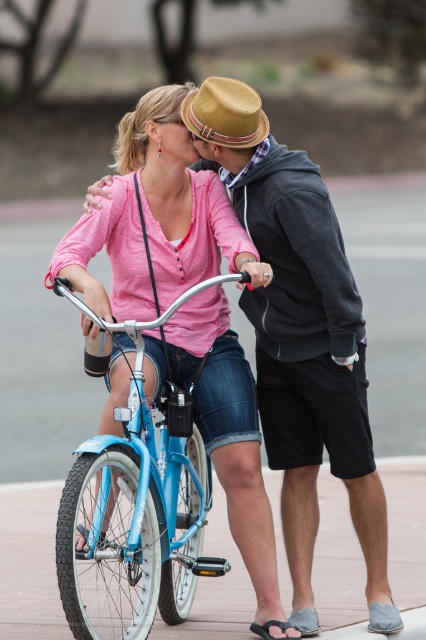
Question: Is matte pink shirt at center further to the viewer compared to blue metallic bicycle at center?

Choices:
 (A) no
 (B) yes

Answer: (B)

Question: Is matte pink shirt at center below blue metallic bicycle at center?

Choices:
 (A) yes
 (B) no

Answer: (B)

Question: Which object appears closest to the camera in this image?

Choices:
 (A) matte pink shirt at center
 (B) blue metallic bicycle at center

Answer: (B)

Question: Does matte pink shirt at center lie in front of blue metallic bicycle at center?

Choices:
 (A) no
 (B) yes

Answer: (A)

Question: Among these objects, which one is nearest to the camera?

Choices:
 (A) blue metallic bicycle at center
 (B) matte pink shirt at center

Answer: (A)